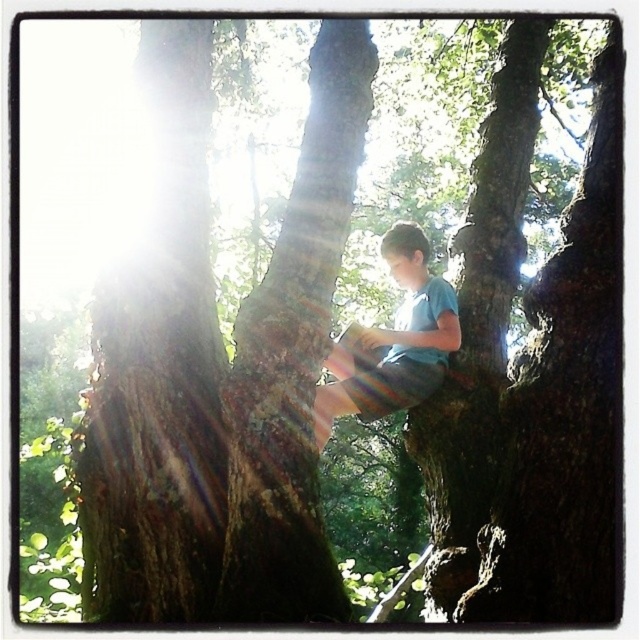
Based on the photo, the boy is sitting under the tree. Which object is positioned higher relative to the other between the brown rough bark at center and the light blue striped shorts at center?

The brown rough bark at center is positioned above the light blue striped shorts at center.

You are standing in the outdoor scene and want to touch the smooth brown bark at left. Where should you move to? Please provide the coordinates in the format of x,y.

The smooth brown bark at left is located at coordinates (160,369). Move to that point to touch it.